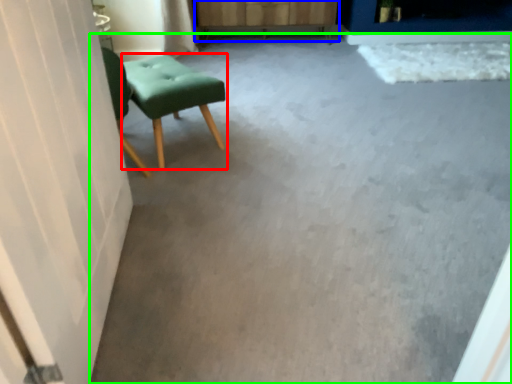
Question: Which is farther away from stool (highlighted by a red box)? dresser (highlighted by a blue box) or concrete (highlighted by a green box)?

Choices:
 (A) dresser
 (B) concrete

Answer: (A)